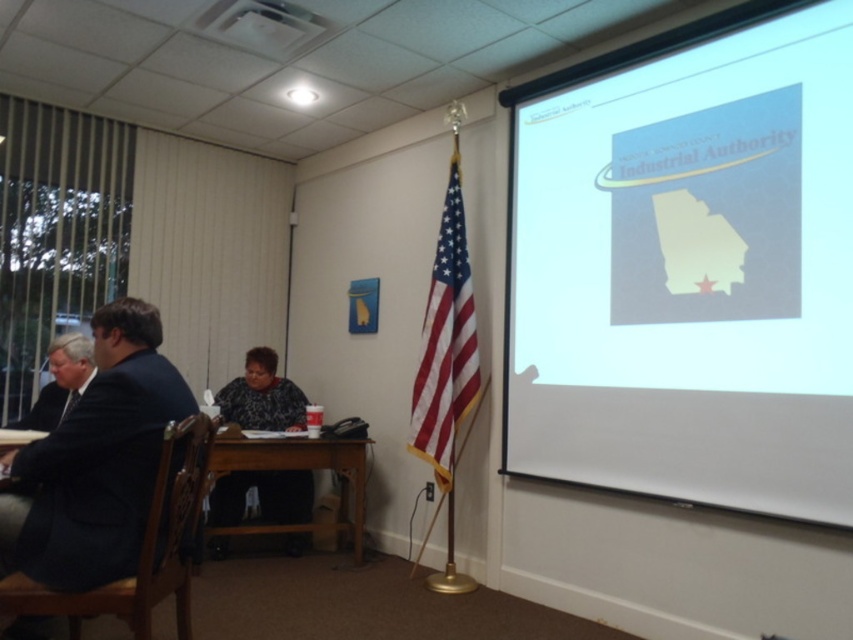
You are an attendee at the meeting and want to see both the patterned fabric shirt at center and the brown wooden table at center. Which one is positioned lower in the image?

The patterned fabric shirt at center is located below the brown wooden table at center, so it is positioned lower in the image.

You are an interior designer assessing the layout of the meeting room. You need to decide whether the patterned fabric shirt at center can be placed on the brown wooden table at center without overhanging the edges. What should you consider based on their sizes?

The patterned fabric shirt at center is thinner than the brown wooden table at center, so it can be placed on the brown wooden table at center without overhanging since its width is narrower.